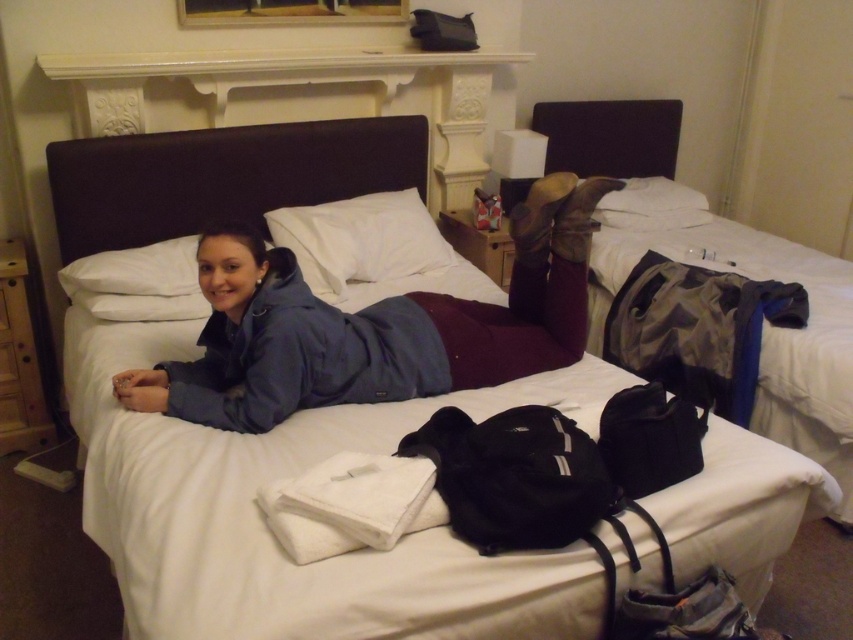
Question: Does blue fabric jacket at center have a larger size compared to white soft pillow at upper center?

Choices:
 (A) yes
 (B) no

Answer: (A)

Question: Is dark brown leather bed at right thinner than white soft pillow at upper center?

Choices:
 (A) yes
 (B) no

Answer: (B)

Question: Does blue fabric jacket at center have a lesser width compared to dark brown leather bed at right?

Choices:
 (A) yes
 (B) no

Answer: (B)

Question: Which of the following is the closest to the observer?

Choices:
 (A) (573, 109)
 (B) (78, 173)

Answer: (B)

Question: Which point appears farthest from the camera in this image?

Choices:
 (A) (97, 157)
 (B) (317, 260)

Answer: (B)

Question: Which point is closer to the camera taking this photo?

Choices:
 (A) (339, 257)
 (B) (404, 134)
 (C) (614, 160)
 (D) (592, 198)

Answer: (D)